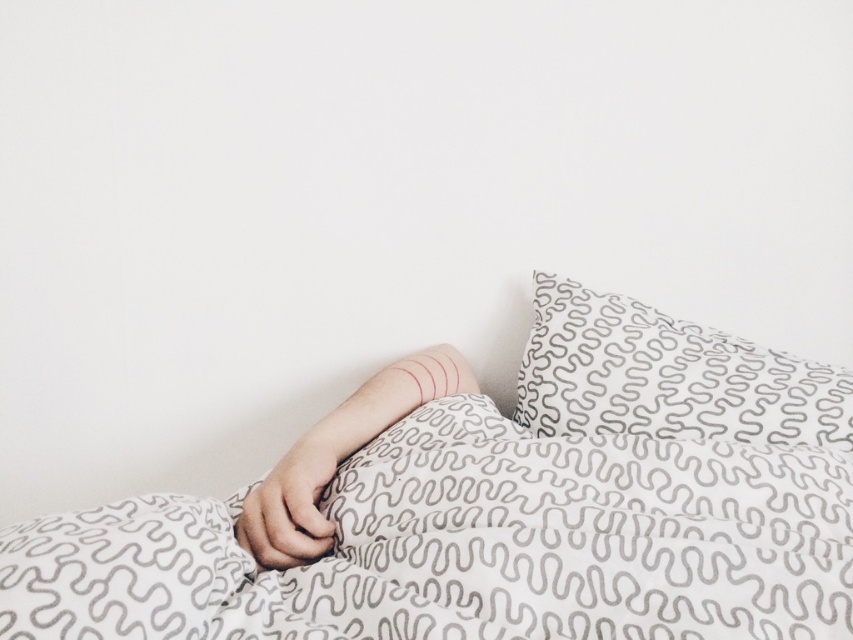
Question: Is white textured fabric at center smaller than white textured pillow at upper right?

Choices:
 (A) no
 (B) yes

Answer: (A)

Question: Which object appears closest to the camera in this image?

Choices:
 (A) white textured fabric at center
 (B) white textured pillow at upper right

Answer: (A)

Question: Among these points, which one is nearest to the camera?

Choices:
 (A) (270, 516)
 (B) (680, 406)

Answer: (A)

Question: Can you confirm if white textured fabric at center is positioned to the left of white textured pillow at upper right?

Choices:
 (A) no
 (B) yes

Answer: (B)

Question: Among these points, which one is farthest from the camera?

Choices:
 (A) (303, 536)
 (B) (606, 326)

Answer: (B)

Question: Can you confirm if white textured fabric at center is smaller than white textured pillow at upper right?

Choices:
 (A) yes
 (B) no

Answer: (B)